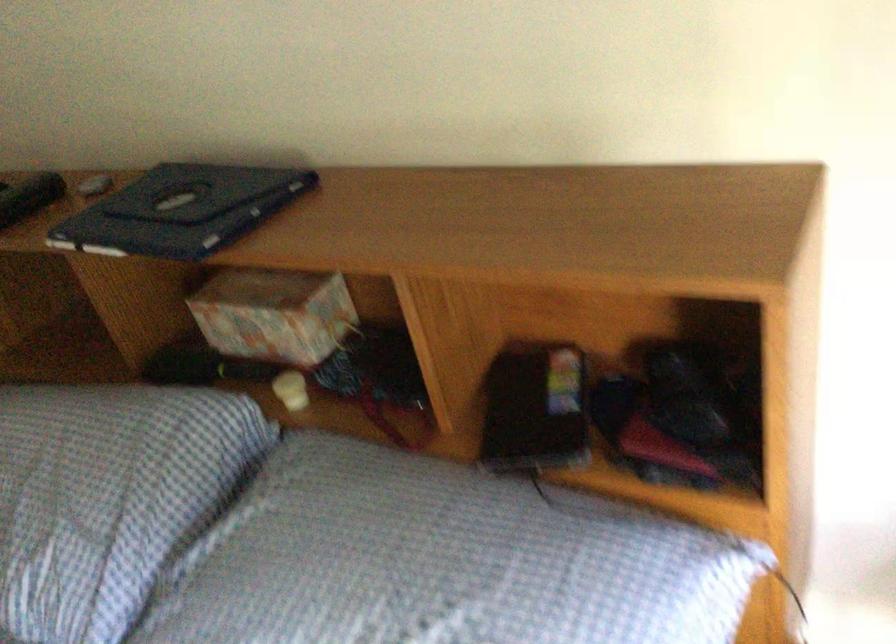
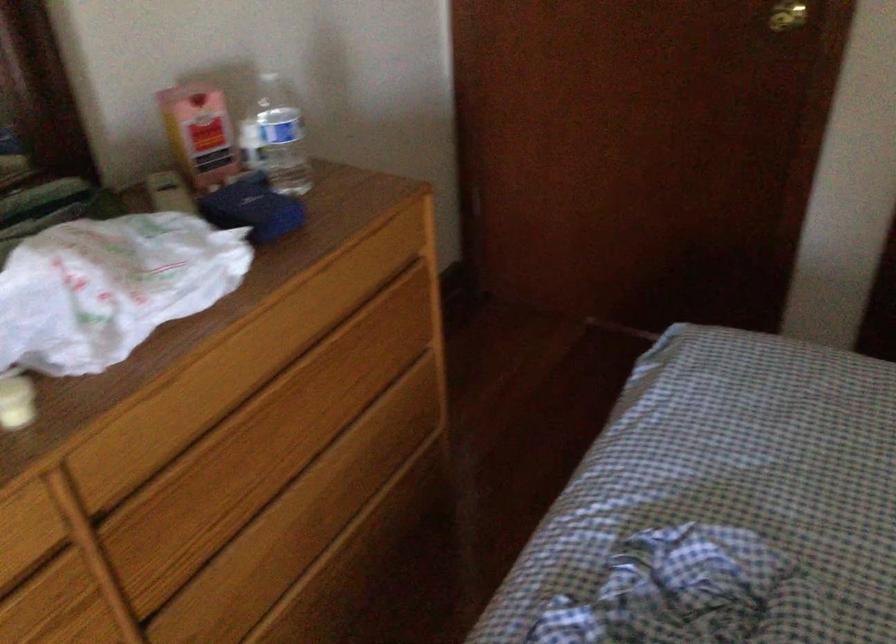
First-person continuous shooting, in which direction is the camera rotating?

The camera rotated toward left-down.